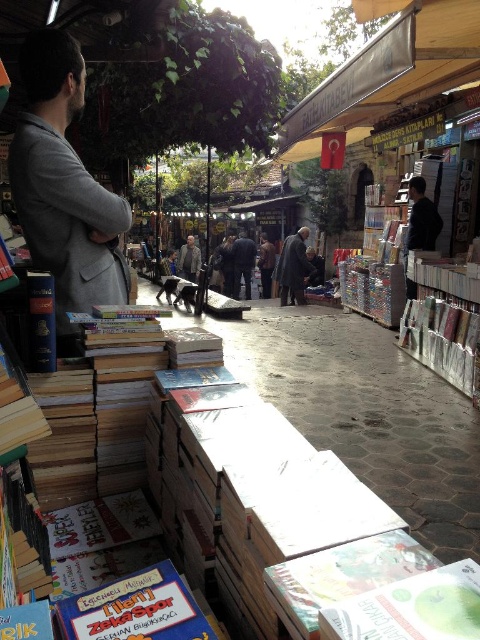
Question: Based on their relative distances, which object is farther from the dark gray jacket at right?

Choices:
 (A) dark gray jacket at center
 (B) dark blue suit at center
 (C) gray wool coat at left
 (D) green matte book at center

Answer: (A)

Question: Can you confirm if green matte book at center is positioned to the right of dark gray jacket at right?

Choices:
 (A) yes
 (B) no

Answer: (B)

Question: Which of the following is the closest to the observer?

Choices:
 (A) dark blue suit at center
 (B) dark gray jacket at center

Answer: (A)

Question: Does dark gray jacket at right have a lesser width compared to dark blue suit at center?

Choices:
 (A) yes
 (B) no

Answer: (A)

Question: Observing the image, what is the correct spatial positioning of dark gray coat at center in reference to dark gray jacket at center?

Choices:
 (A) right
 (B) left

Answer: (A)

Question: Which point appears closest to the camera in this image?

Choices:
 (A) (192, 246)
 (B) (408, 608)
 (C) (276, 269)
 (D) (71, 605)

Answer: (B)